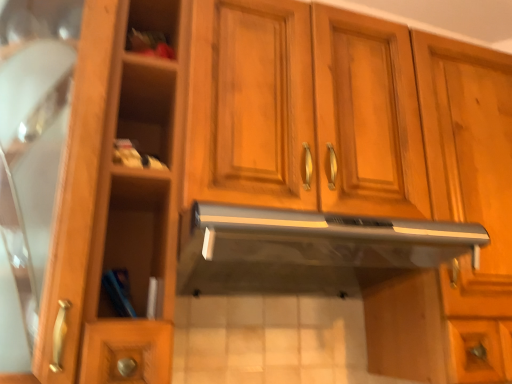
In order to click on satin silver exhaust hood at center in this screenshot , I will do `click(331, 238)`.

What do you see at coordinates (331, 238) in the screenshot?
I see `satin silver exhaust hood at center` at bounding box center [331, 238].

The width and height of the screenshot is (512, 384). In order to click on satin silver exhaust hood at center in this screenshot , I will do `click(331, 238)`.